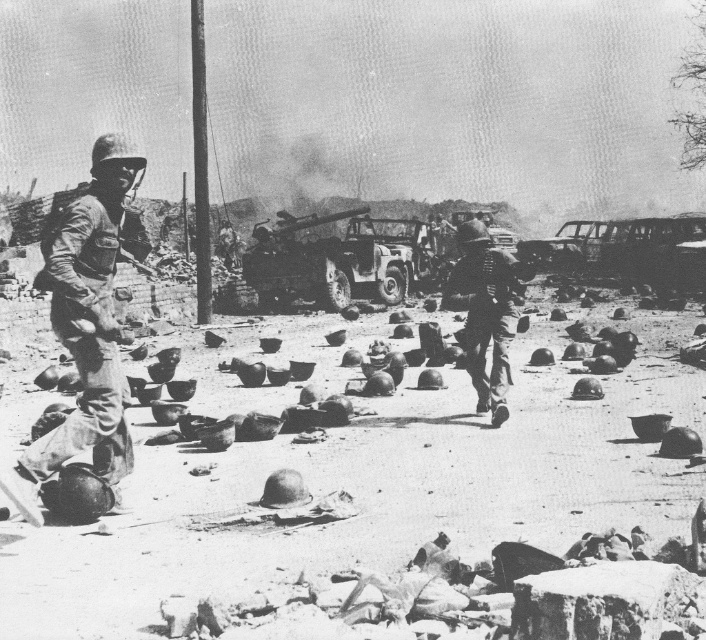
Question: Where is metallic matte tank at center located in relation to metallic helmet at center in the image?

Choices:
 (A) below
 (B) above

Answer: (B)

Question: Observing the image, what is the correct spatial positioning of metallic helmet at left in reference to metallic matte tank at center?

Choices:
 (A) right
 (B) left

Answer: (B)

Question: Does metallic matte tank at center have a larger size compared to metallic helmet at center?

Choices:
 (A) no
 (B) yes

Answer: (B)

Question: Estimate the real-world distances between objects in this image. Which object is closer to the metallic helmet at center?

Choices:
 (A) metallic helmet at left
 (B) metallic matte tank at center

Answer: (A)

Question: Among these points, which one is nearest to the camera?

Choices:
 (A) (491, 412)
 (B) (131, 257)
 (C) (426, 266)

Answer: (B)

Question: Which object appears closest to the camera in this image?

Choices:
 (A) metallic helmet at left
 (B) metallic matte tank at center
 (C) metallic helmet at center

Answer: (A)